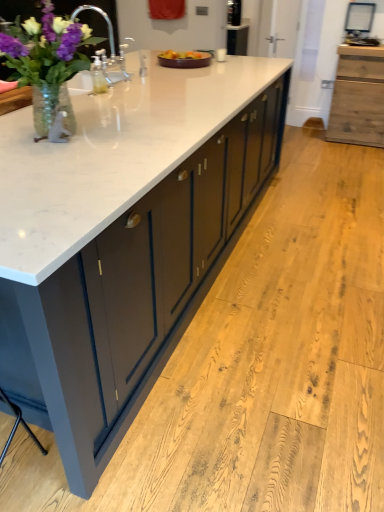
The width and height of the screenshot is (384, 512). Find the location of `vacant region below clear glass vase at left (from a real-world perspective)`. vacant region below clear glass vase at left (from a real-world perspective) is located at coordinates (67, 138).